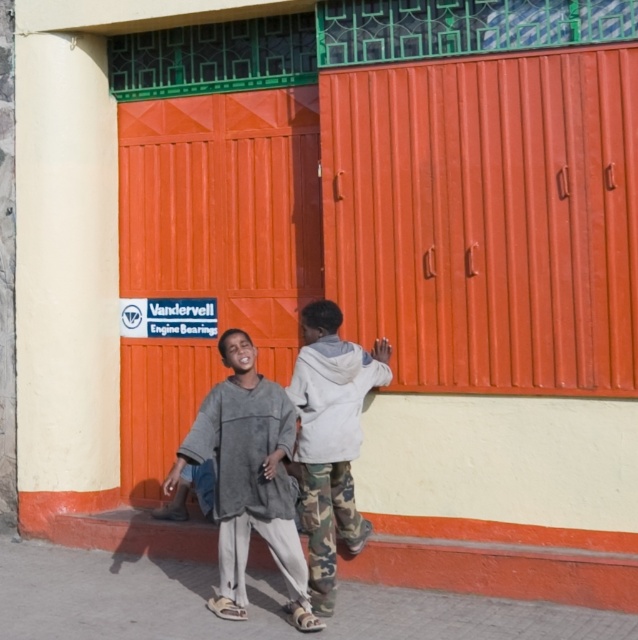
Question: Which object appears closest to the camera in this image?

Choices:
 (A) gray fleece sweater at lower left
 (B) orange corrugated metal door at center

Answer: (A)

Question: Does orange corrugated metal at center have a lesser width compared to camouflage pants at center?

Choices:
 (A) no
 (B) yes

Answer: (A)

Question: Does orange corrugated metal at center have a lesser width compared to camouflage pants at center?

Choices:
 (A) yes
 (B) no

Answer: (B)

Question: Which of these objects is positioned closest to the camouflage pants at center?

Choices:
 (A) orange corrugated metal at center
 (B) gray fleece sweater at lower left
 (C) orange corrugated metal door at center

Answer: (B)

Question: Which of the following is the closest to the observer?

Choices:
 (A) camouflage pants at center
 (B) orange corrugated metal at center
 (C) gray fleece sweater at lower left
 (D) orange corrugated metal door at center

Answer: (C)

Question: From the image, what is the correct spatial relationship of gray fleece sweater at lower left in relation to camouflage pants at center?

Choices:
 (A) below
 (B) above

Answer: (A)